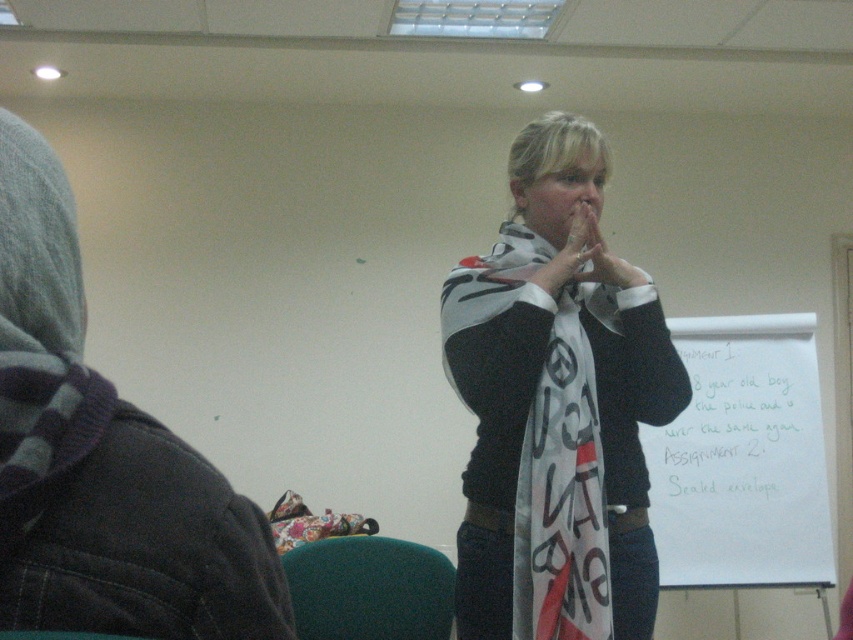
You are an attendee at the presentation and want to see both the white paper at center and the white matte scarf at center. Which one is positioned lower in the image?

The white paper at center is located below the white matte scarf at center, so the white paper at center is positioned lower in the image.

You are sitting in the front row of the classroom and notice two white items at the center of the scene. Which one is closer to you, the white paper at center or the white printed scarf at center?

The white paper at center is closer to you because it is further to the viewer than the white printed scarf at center.

You are organizing a presentation and need to display both the white paper at center and the white printed scarf at center. Since both items are white, how can you ensure they are easily distinguishable to the audience?

The white paper at center has a larger size compared to the white printed scarf at center, so you can position the larger white paper at center in a prominent location and place the smaller white printed scarf at center nearby to create visual contrast based on their size difference.